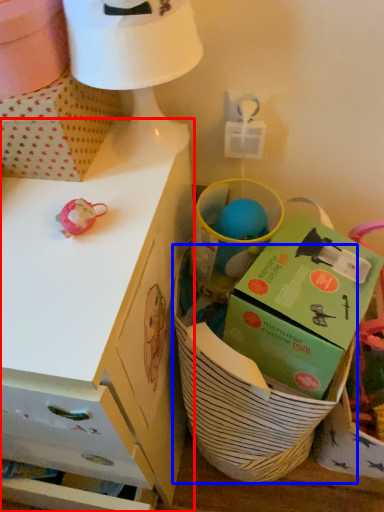
Question: Which of the following is the closest to the observer, desk (highlighted by a red box) or basket (highlighted by a blue box)?

Choices:
 (A) desk
 (B) basket

Answer: (A)